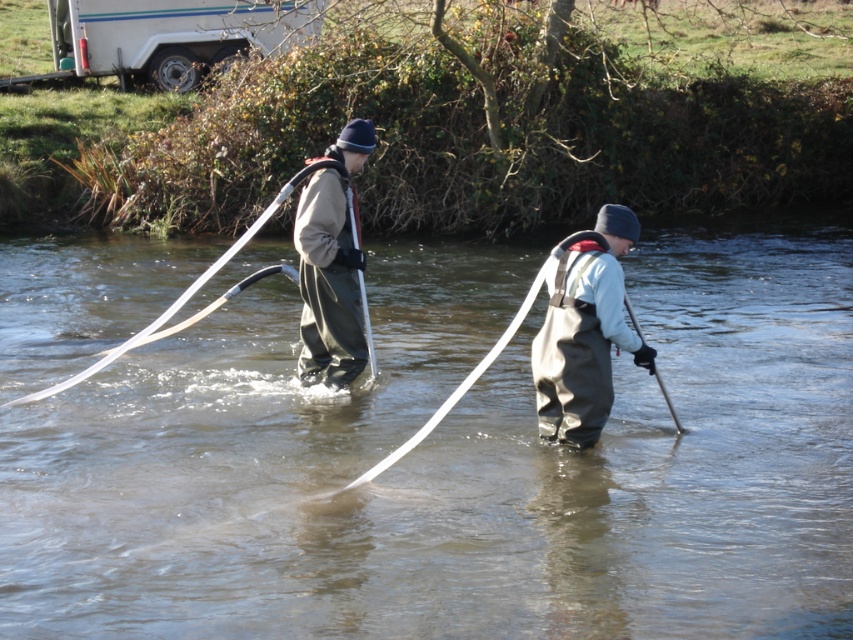
Question: Does brown rubber boots at center lie in front of matte gray waders at center?

Choices:
 (A) no
 (B) yes

Answer: (B)

Question: Does brown rubber boots at center have a lesser width compared to gray rubber waders at center?

Choices:
 (A) no
 (B) yes

Answer: (A)

Question: Which object appears farthest from the camera in this image?

Choices:
 (A) gray rubber waders at center
 (B) matte gray waders at center

Answer: (B)

Question: Which object is the closest to the brown rubber boots at center?

Choices:
 (A) gray rubber waders at center
 (B) matte gray waders at center

Answer: (B)

Question: Is brown rubber boots at center thinner than gray rubber waders at center?

Choices:
 (A) yes
 (B) no

Answer: (B)

Question: Considering the real-world distances, which object is closest to the gray rubber waders at center?

Choices:
 (A) brown rubber boots at center
 (B) matte gray waders at center

Answer: (B)